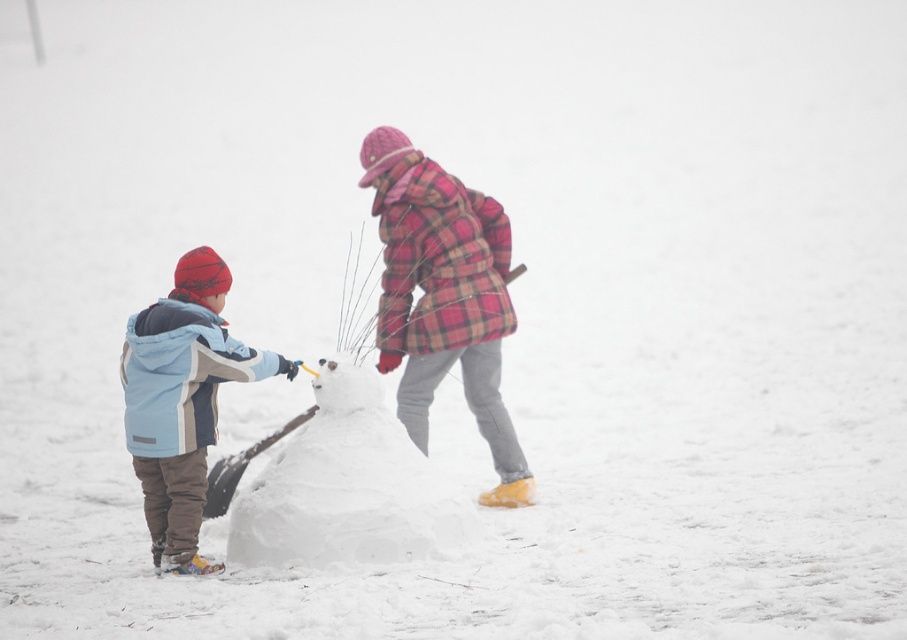
Is plaid fabric coat at center positioned at the back of light blue fleece jacket at left?

Yes.

Looking at this image, is plaid fabric coat at center shorter than light blue fleece jacket at left?

No.

Between point (455, 358) and point (162, 308), which one is positioned in front?

Positioned in front is point (162, 308).

Find the location of a particular element. This screenshot has height=640, width=907. plaid fabric coat at center is located at coordinates (444, 298).

Does plaid fabric coat at center appear on the right side of white fluffy snowman at center?

Yes, plaid fabric coat at center is to the right of white fluffy snowman at center.

Between plaid fabric coat at center and white fluffy snowman at center, which one has less height?

Standing shorter between the two is white fluffy snowman at center.

This screenshot has height=640, width=907. What do you see at coordinates (444, 298) in the screenshot? I see `plaid fabric coat at center` at bounding box center [444, 298].

At what (x,y) coordinates should I click in order to perform the action: click on plaid fabric coat at center. Please return your answer as a coordinate pair (x, y). The width and height of the screenshot is (907, 640). Looking at the image, I should click on (444, 298).

Based on the photo, who is positioned more to the right, white fluffy snowman at center or light blue fleece jacket at left?

From the viewer's perspective, white fluffy snowman at center appears more on the right side.

Between point (384, 449) and point (138, 465), which one is positioned behind?

Point (384, 449)

This screenshot has width=907, height=640. What are the coordinates of `white fluffy snowman at center` in the screenshot? It's located at pyautogui.click(x=346, y=486).

I want to click on white fluffy snowman at center, so click(x=346, y=486).